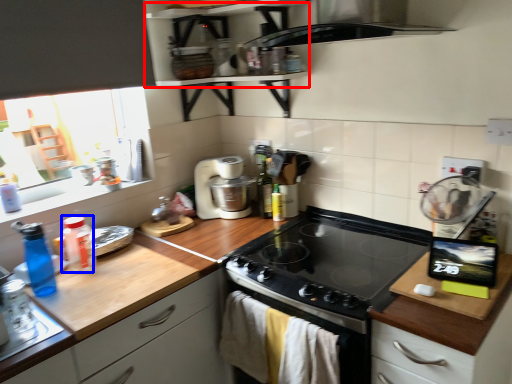
Question: Which object appears closest to the camera in this image, shelf (highlighted by a red box) or bottle (highlighted by a blue box)?

Choices:
 (A) shelf
 (B) bottle

Answer: (A)